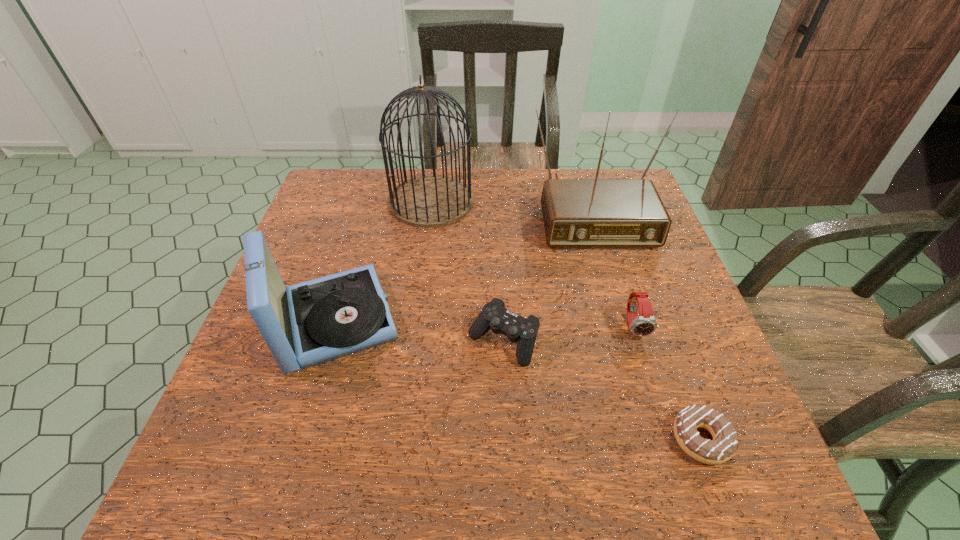
The width and height of the screenshot is (960, 540). I want to click on birdcage, so click(429, 201).

Find the location of a particular element. Image resolution: width=960 pixels, height=540 pixels. the fifth shortest object is located at coordinates (577, 213).

The image size is (960, 540). I want to click on the fourth shortest object, so click(313, 322).

I want to click on the fourth tallest object, so click(644, 324).

Find the location of a particular element. control is located at coordinates (494, 315).

The width and height of the screenshot is (960, 540). What are the coordinates of `the nearest object` in the screenshot? It's located at (724, 444).

Where is `the shortest object`? The height and width of the screenshot is (540, 960). the shortest object is located at coordinates (724, 444).

Find the location of `vacant area situated 0.080m at the door of the birdcage`. vacant area situated 0.080m at the door of the birdcage is located at coordinates (425, 247).

The width and height of the screenshot is (960, 540). I want to click on vacant region located 0.090m on the front panel of the radio_receiver, so click(608, 275).

This screenshot has height=540, width=960. What are the coordinates of `vacant space situated on the right of the phonograph record` in the screenshot? It's located at (477, 320).